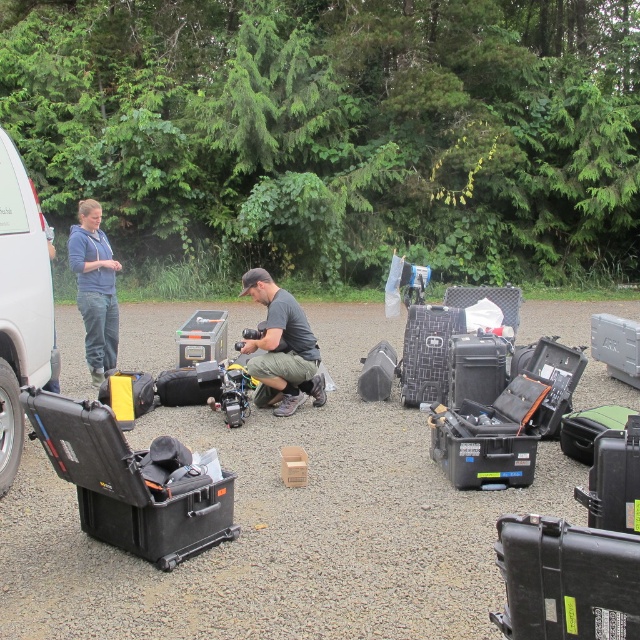
You are a photographer who needs to transport both the white matte van at left and the blue cotton hoodie at upper left into a storage facility. The entrance of the facility has a height restriction of 2 meters. Can both items fit through the entrance based on their sizes?

The white matte van at left is larger in size than the blue cotton hoodie at upper left. Since the van is larger, it is possible that it exceeds the 2 meter height restriction. However, without specific height measurements, we cannot definitively determine if both items will fit through the entrance.

Based on the photo, you are a crew member setting up equipment for a film shoot. You have to place the black hard case at center and the white matte van at left in a specific arrangement. Based on their sizes, which object should be placed closer to the camera to ensure both are in frame without distortion?

The black hard case at center is not as tall as the white matte van at left, so to ensure both are in frame without distortion, the taller white matte van at left should be placed closer to the camera while the shorter black hard case at center can be positioned further back.